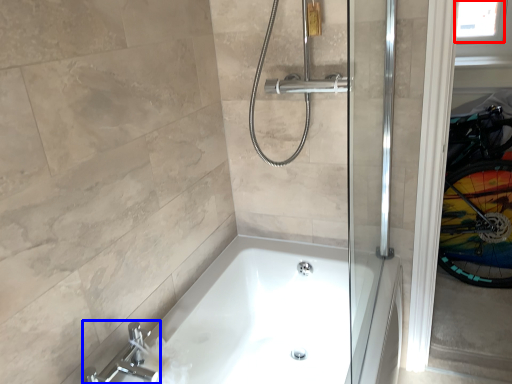
Question: Which object is further to the camera taking this photo, window screen (highlighted by a red box) or tap (highlighted by a blue box)?

Choices:
 (A) window screen
 (B) tap

Answer: (A)